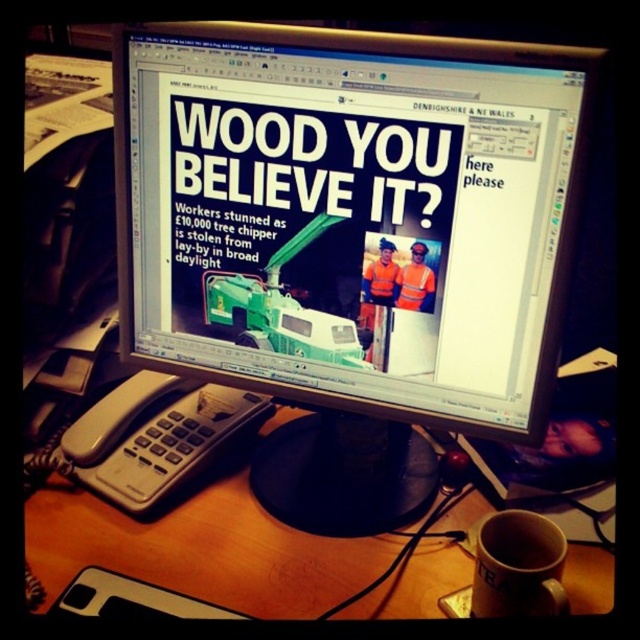
Question: Is matte plastic monitor at center bigger than reflective orange vest at center?

Choices:
 (A) yes
 (B) no

Answer: (A)

Question: Can you confirm if matte plastic monitor at center is smaller than reflective orange vest at center?

Choices:
 (A) no
 (B) yes

Answer: (A)

Question: Which point is closer to the camera?

Choices:
 (A) (422, 243)
 (B) (180, 51)

Answer: (A)

Question: Which object appears farthest from the camera in this image?

Choices:
 (A) matte plastic monitor at center
 (B) reflective orange vest at center

Answer: (B)

Question: Can you confirm if matte plastic monitor at center is positioned above reflective orange vest at center?

Choices:
 (A) yes
 (B) no

Answer: (A)